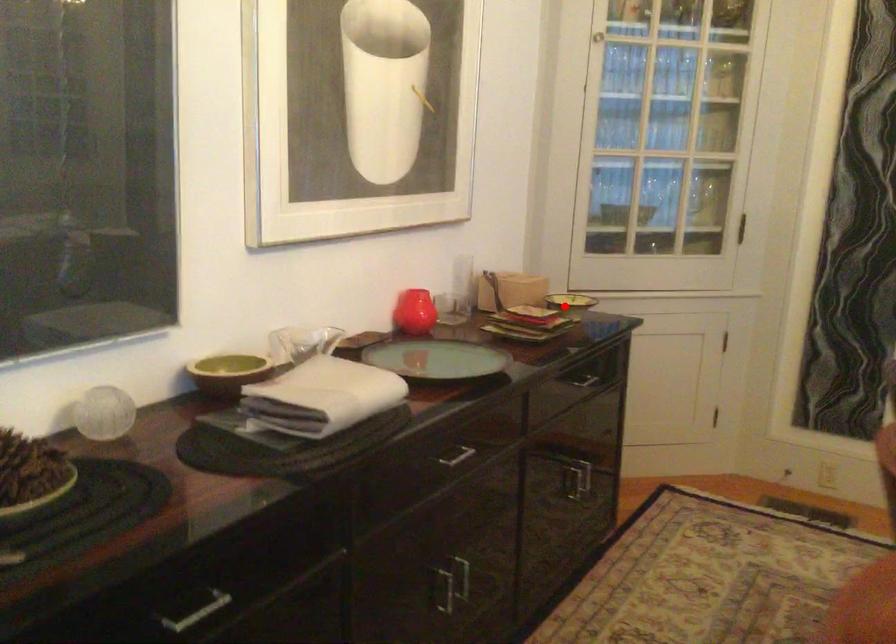
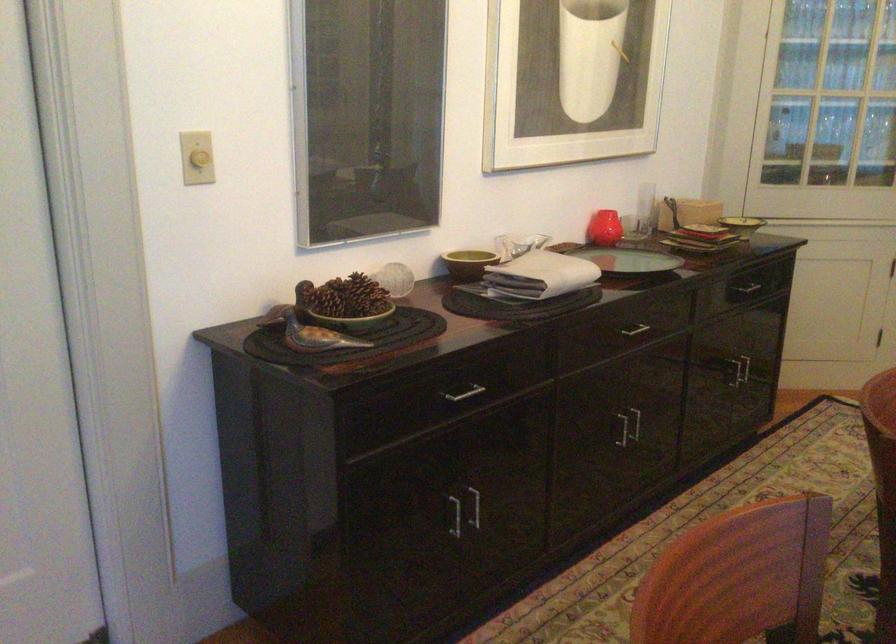
The point at the highlighted location is marked in the first image. Where is the corresponding point in the second image?

(742, 225)